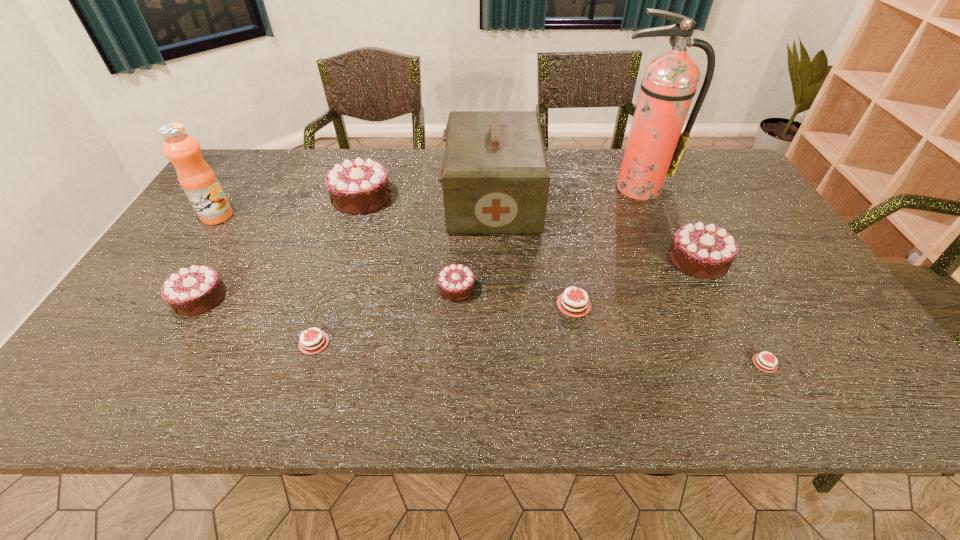
This screenshot has width=960, height=540. What are the coordinates of `the fourth tallest chocolate cake` in the screenshot? It's located at (444, 353).

At what (x,y) coordinates should I click in order to perform the action: click on the third chocolate chocolate cake from left to right. Please return your answer as a coordinate pair (x, y). Looking at the image, I should click on (444, 353).

The image size is (960, 540). Identify the location of the fifth tallest chocolate cake. (658, 376).

What are the coordinates of `the second red chocolate cake from right to left` in the screenshot? It's located at (658, 376).

This screenshot has width=960, height=540. In order to click on the sixth tallest chocolate cake in this screenshot , I will do `click(658, 376)`.

At what (x,y) coordinates should I click in order to perform the action: click on the second shortest object. Please return your answer as a coordinate pair (x, y). Looking at the image, I should click on (658, 376).

Identify the location of the shortest chocolate cake. This screenshot has height=540, width=960. (658, 376).

Where is `the rightmost red chocolate cake`? the rightmost red chocolate cake is located at coordinates (658, 376).

What are the coordinates of `free region located at the nozzle of the fire extinguisher` in the screenshot? It's located at (648, 218).

Where is `vacant region located 0.120m on the right of the fruit juice`? This screenshot has height=540, width=960. vacant region located 0.120m on the right of the fruit juice is located at coordinates click(x=274, y=216).